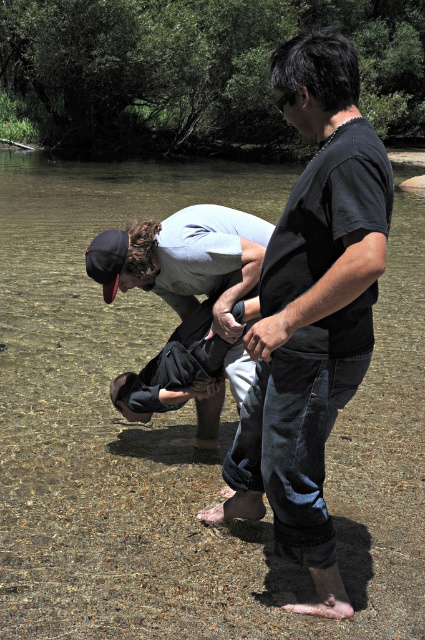
In the scene shown: You are a photographer trying to capture a photo of both the black matte shirt at center and the light gray cotton shirt at center. Since you want to ensure both are fully visible in the frame, which person should you position closer to the camera to avoid any overlap?

The light gray cotton shirt at center should be positioned closer to the camera because the black matte shirt at center is much taller, so moving the shorter light gray cotton shirt at center forward will prevent overlap and ensure both are visible.

You are a photographer trying to capture a photo of the two people in the river scene. You want to ensure both the black matte shirt at center and the light gray cotton shirt at center are clearly visible. Which shirt should you focus on first if you want to capture the one closer to the left side?

The light gray cotton shirt at center is to the left of the black matte shirt at center, so you should focus on the light gray cotton shirt at center first since it is closer to the left side.

You are a photographer trying to capture both the black matte shirt at center and the light gray cotton shirt at center in a single frame. Since the camera can only focus on one subject at a time, which subject should you choose to ensure the larger one is in focus?

The black matte shirt at center is larger than the light gray cotton shirt at center, so you should focus on the black matte shirt at center to ensure the larger one is in focus.